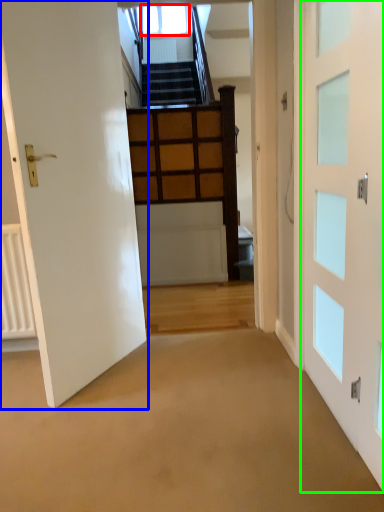
Question: Considering the real-world distances, which object is closest to window (highlighted by a red box)? door (highlighted by a blue box) or door (highlighted by a green box).

Choices:
 (A) door
 (B) door

Answer: (A)